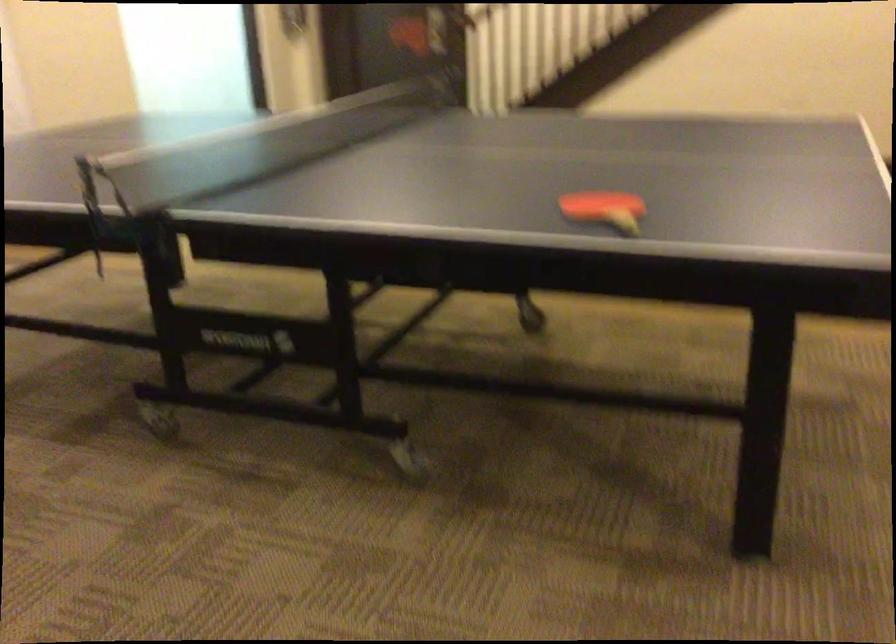
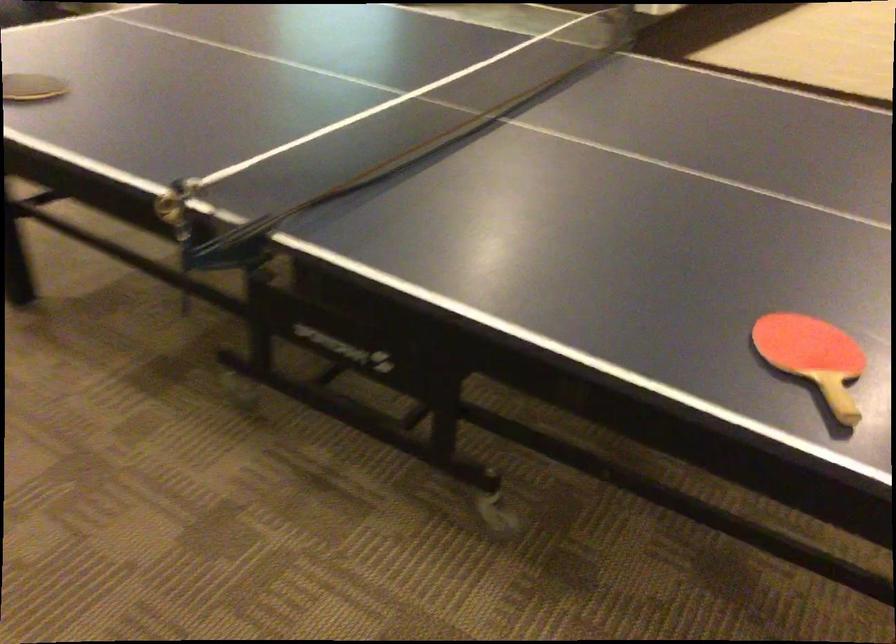
From the picture: Which direction would the cameraman need to move to produce the second image?

The cameraman moved toward left, forward.